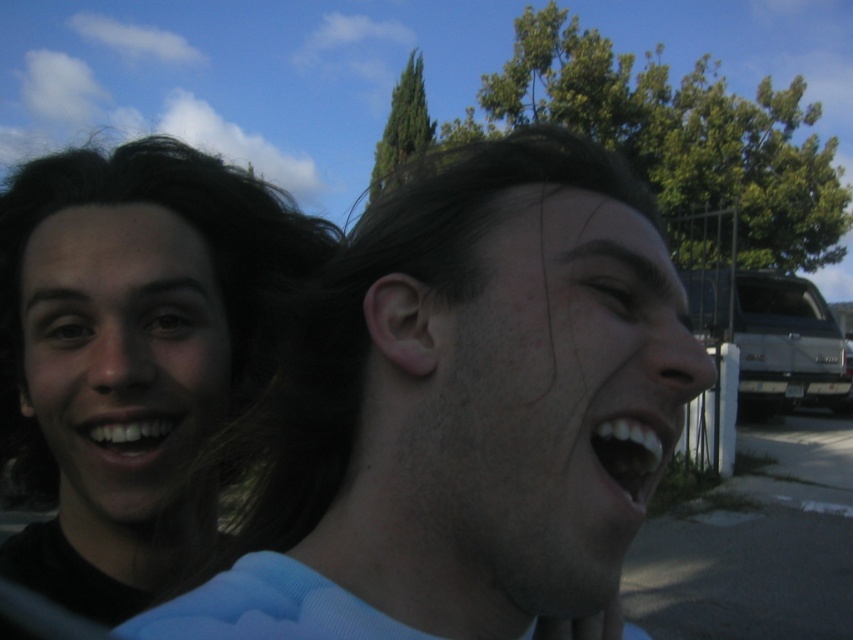
Question: Does light blue fabric at center have a greater width compared to white glossy teeth at center?

Choices:
 (A) no
 (B) yes

Answer: (B)

Question: Which object is the farthest from the matte black face at left?

Choices:
 (A) matte black hair at left
 (B) white glossy teeth at center
 (C) smooth skin face at center
 (D) silver metallic truck at right

Answer: (D)

Question: Estimate the real-world distances between objects in this image. Which object is farther from the matte black hair at left?

Choices:
 (A) light blue fabric at center
 (B) matte black face at left
 (C) silver metallic truck at right

Answer: (C)

Question: Can you confirm if light blue fabric at center is positioned below white glossy teeth at center?

Choices:
 (A) no
 (B) yes

Answer: (B)

Question: Where is matte black hair at left located in relation to smooth skin face at center in the image?

Choices:
 (A) right
 (B) left

Answer: (B)

Question: Which of the following is the closest to the observer?

Choices:
 (A) (525, 195)
 (B) (503, 237)
 (C) (183, 410)
 (D) (733, 298)

Answer: (B)